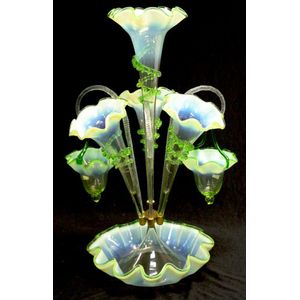
Where is `blue interior`? Image resolution: width=300 pixels, height=300 pixels. blue interior is located at coordinates (98, 119), (186, 115), (175, 239).